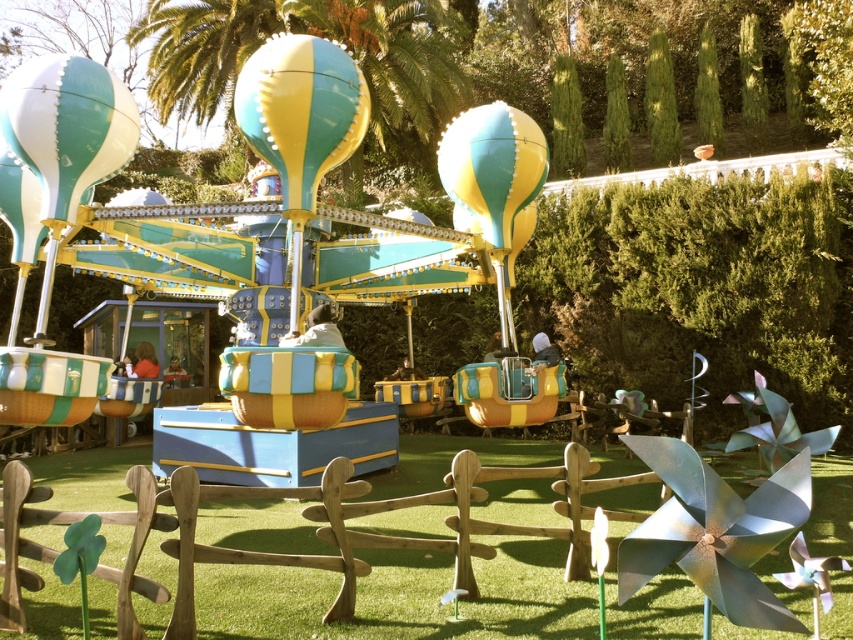
Looking at this image, you are a photographer planning to capture a wide shot of the teal and yellow striped balloon at center and the teal glossy hot air balloon at upper left. Based on their sizes, which balloon should you focus on to ensure it fills more of your camera frame?

The teal glossy hot air balloon at upper left should be focused on because it is thicker than the teal and yellow striped balloon at center, making it larger in size and thus occupying more space in the camera frame.

You are standing at the edge of the carousel ride in the park. You see a teal and yellow striped balloon at center. Where is the point located at coordinates (300, 112) in relation to the teal and yellow striped balloon at center?

The point located at coordinates (300, 112) is on the teal and yellow striped balloon at center.